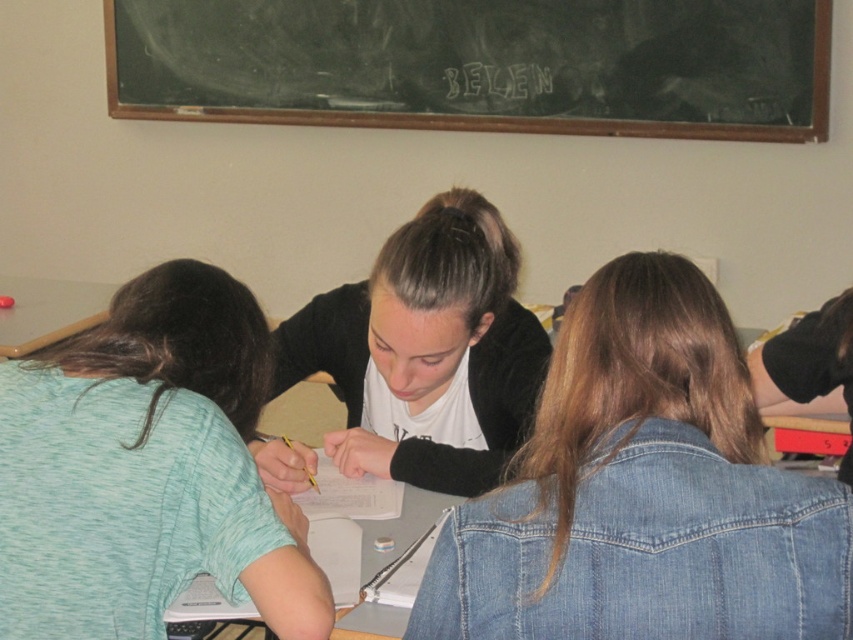
You are standing in the classroom and need to locate the denim jacket at center. According to the coordinates provided, where would you find it?

The denim jacket at center is located at coordinates point [643,492].

You are a student in the classroom and need to place a 12x12 inch square object on the table. The table has the teal fabric shirt at lower left and the white paper at center. Can you fit the square object on the table without overlapping either of these items?

The teal fabric shirt at lower left is bigger than white paper at center. Since the shirt is larger, it occupies more space on the table. However, without knowing the exact dimensions of the table or the objects, it is uncertain if the 12x12 inch square object can fit without overlapping. More information about the table size or the objects is needed to determine this.